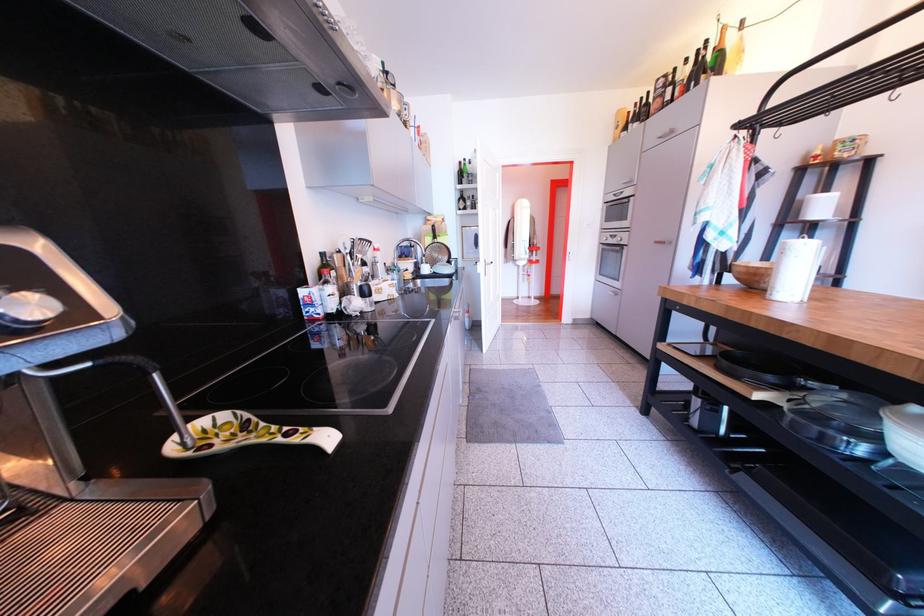
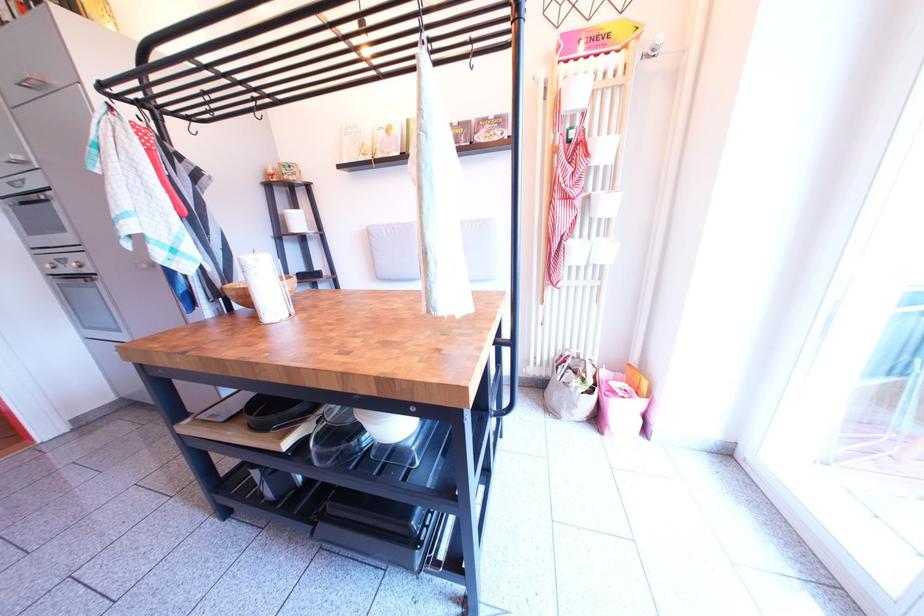
In the second image, find the point that corresponds to (x=813, y=208) in the first image.

(295, 222)